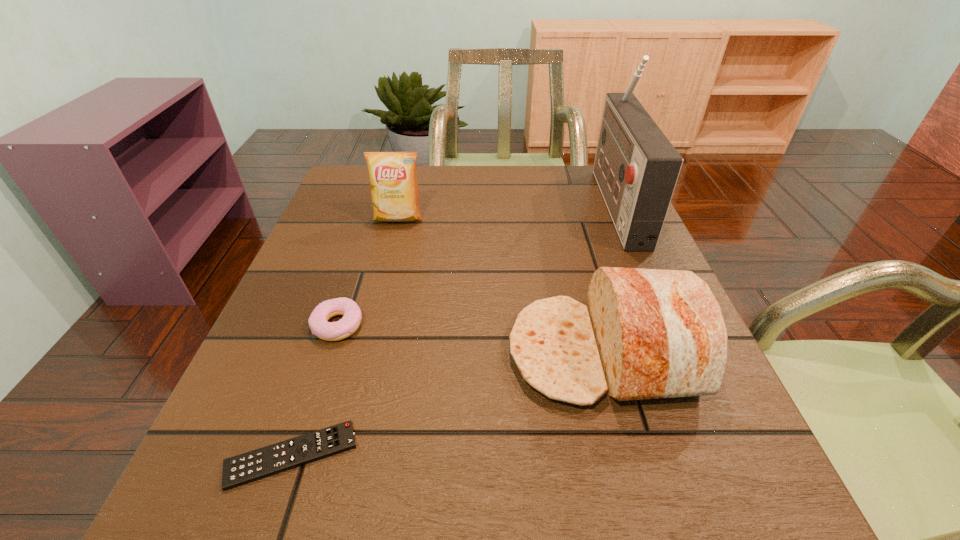
The image size is (960, 540). What are the coordinates of `object that is the third nearest to the remote control` in the screenshot? It's located at (394, 190).

Where is `free space that satisfies the following two spatial constraints: 1. at the sliced end of the bread; 2. on the front side of the nearest object`? This screenshot has width=960, height=540. free space that satisfies the following two spatial constraints: 1. at the sliced end of the bread; 2. on the front side of the nearest object is located at coordinates (631, 455).

This screenshot has width=960, height=540. Find the location of `vacant space that satisfies the following two spatial constraints: 1. on the front panel of the tallest object; 2. on the front-facing side of the crisp (potato chip)`. vacant space that satisfies the following two spatial constraints: 1. on the front panel of the tallest object; 2. on the front-facing side of the crisp (potato chip) is located at coordinates (622, 219).

The height and width of the screenshot is (540, 960). I want to click on free space that satisfies the following two spatial constraints: 1. at the sliced end of the bread; 2. on the front side of the shortest object, so click(x=631, y=455).